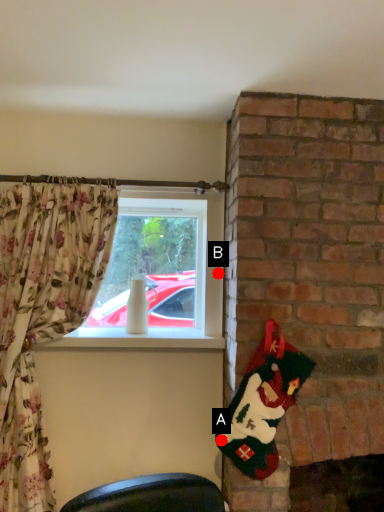
Question: Two points are circled on the image, labeled by A and B beside each circle. Which point is farther from the camera taking this photo?

Choices:
 (A) A is further
 (B) B is further

Answer: (B)